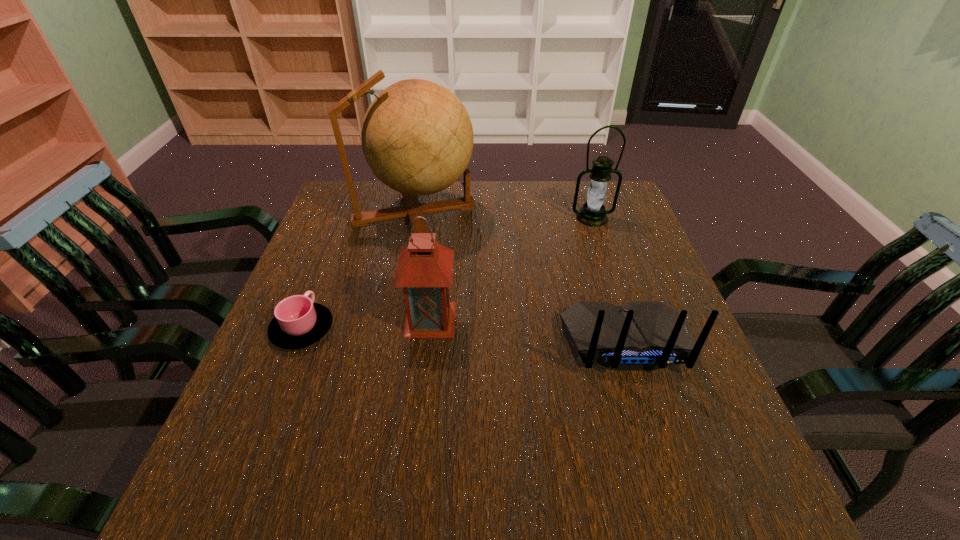
Find the location of a particular element. free space located on the side with the handle of the shortest object is located at coordinates (342, 230).

Where is `vacant space located 0.100m on the side with the handle of the shortest object`? Image resolution: width=960 pixels, height=540 pixels. vacant space located 0.100m on the side with the handle of the shortest object is located at coordinates (323, 278).

Identify the location of globe present at the far edge. (417, 137).

Where is `lantern located in the far edge section of the desktop`? This screenshot has height=540, width=960. lantern located in the far edge section of the desktop is located at coordinates (592, 213).

I want to click on globe located in the left edge section of the desktop, so click(417, 137).

Find the location of a particular element. cup located at the left edge is located at coordinates (299, 322).

I want to click on lantern situated at the right edge, so click(x=592, y=213).

Find the location of a particular element. Image resolution: width=960 pixels, height=540 pixels. router that is at the right edge is located at coordinates (637, 336).

Find the location of a particular element. The image size is (960, 540). object present at the far left corner is located at coordinates (417, 137).

Identify the location of object present at the far right corner. The image size is (960, 540). (592, 213).